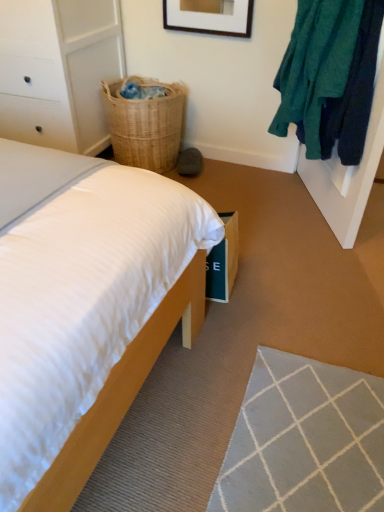
Question: Is wooden bed at lower left behind woven natural basket at upper right?

Choices:
 (A) yes
 (B) no

Answer: (B)

Question: Considering the relative sizes of wooden bed at lower left and woven natural basket at upper right in the image provided, is wooden bed at lower left bigger than woven natural basket at upper right?

Choices:
 (A) no
 (B) yes

Answer: (B)

Question: Can you confirm if wooden bed at lower left is positioned to the right of woven natural basket at upper right?

Choices:
 (A) yes
 (B) no

Answer: (A)

Question: Is wooden bed at lower left wider than woven natural basket at upper right?

Choices:
 (A) yes
 (B) no

Answer: (A)

Question: Considering the relative sizes of wooden bed at lower left and woven natural basket at upper right in the image provided, is wooden bed at lower left thinner than woven natural basket at upper right?

Choices:
 (A) yes
 (B) no

Answer: (B)

Question: Does wooden bed at lower left turn towards woven natural basket at upper right?

Choices:
 (A) no
 (B) yes

Answer: (A)

Question: Could you tell me if wooden bed at lower left is facing teal fuzzy sweater at upper right?

Choices:
 (A) no
 (B) yes

Answer: (A)

Question: Is teal fuzzy sweater at upper right surrounded by wooden bed at lower left?

Choices:
 (A) no
 (B) yes

Answer: (A)

Question: Is wooden bed at lower left closer to the viewer compared to teal fuzzy sweater at upper right?

Choices:
 (A) yes
 (B) no

Answer: (A)

Question: Can you confirm if wooden bed at lower left is wider than teal fuzzy sweater at upper right?

Choices:
 (A) no
 (B) yes

Answer: (B)

Question: Can you confirm if wooden bed at lower left is taller than teal fuzzy sweater at upper right?

Choices:
 (A) no
 (B) yes

Answer: (A)

Question: Considering the relative sizes of wooden bed at lower left and teal fuzzy sweater at upper right in the image provided, is wooden bed at lower left thinner than teal fuzzy sweater at upper right?

Choices:
 (A) no
 (B) yes

Answer: (A)

Question: From the image's perspective, is white painted wood dresser at left below woven natural basket at upper right?

Choices:
 (A) yes
 (B) no

Answer: (B)